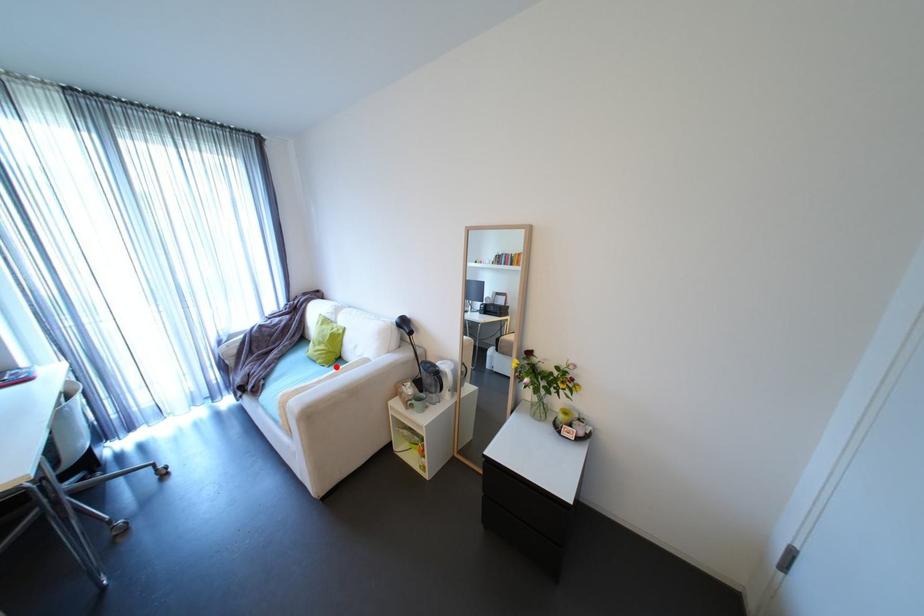
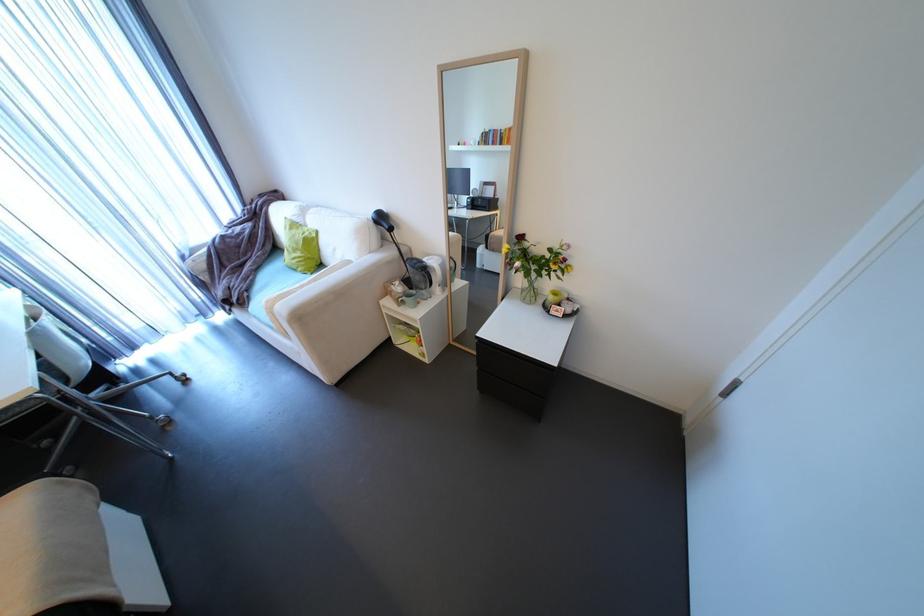
Question: A red point is marked in image1. In image2, is the corresponding 3D point closer to the camera or farther? Reply with the corresponding letter.

Choices:
 (A) The corresponding 3D point is closer.
 (B) The corresponding 3D point is farther.

Answer: (B)